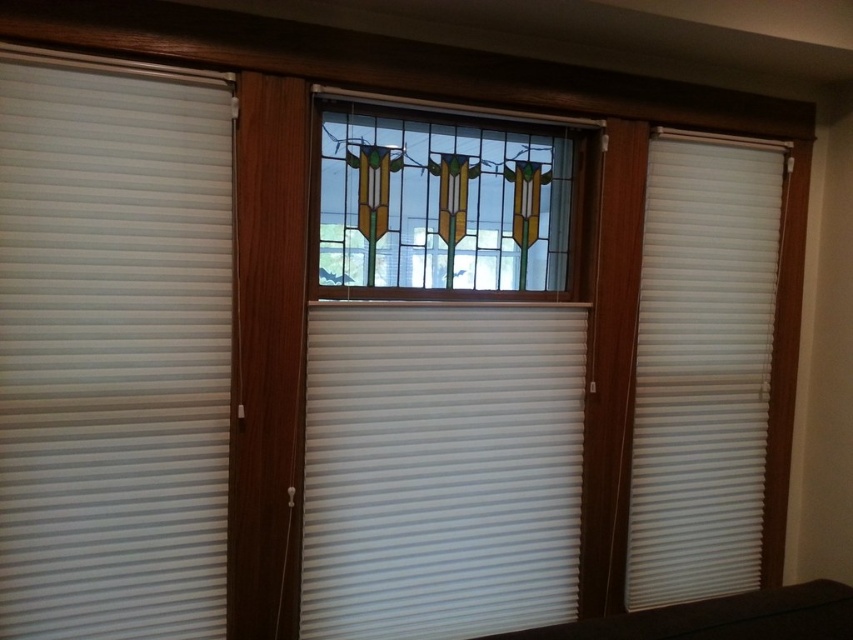
Question: Does white matte blinds at left have a greater width compared to white pleated blind at center?

Choices:
 (A) no
 (B) yes

Answer: (A)

Question: Which of the following is the farthest from the observer?

Choices:
 (A) white matte blinds at left
 (B) white matte blind at right
 (C) white pleated blind at center

Answer: (B)

Question: Is white matte blinds at left smaller than white pleated blind at center?

Choices:
 (A) no
 (B) yes

Answer: (B)

Question: Which object appears closest to the camera in this image?

Choices:
 (A) white pleated blind at center
 (B) white matte blind at right
 (C) white matte blinds at left
 (D) stained glass window at center

Answer: (C)

Question: Which is farther from the white matte blind at right?

Choices:
 (A) white matte blinds at left
 (B) stained glass window at center

Answer: (A)

Question: Does white matte blinds at left come in front of white matte blind at right?

Choices:
 (A) no
 (B) yes

Answer: (B)